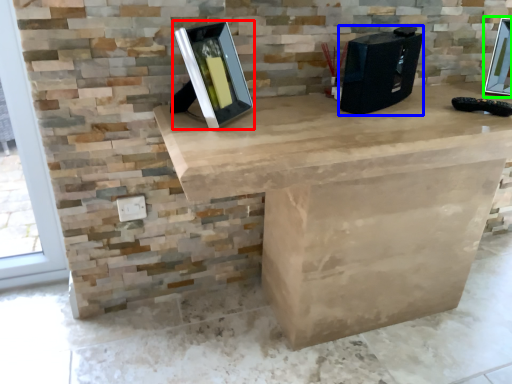
Question: Which object is positioned farthest from picture frame (highlighted by a red box)? Select from desktop computer (highlighted by a blue box) and picture frame (highlighted by a green box).

Choices:
 (A) desktop computer
 (B) picture frame

Answer: (B)